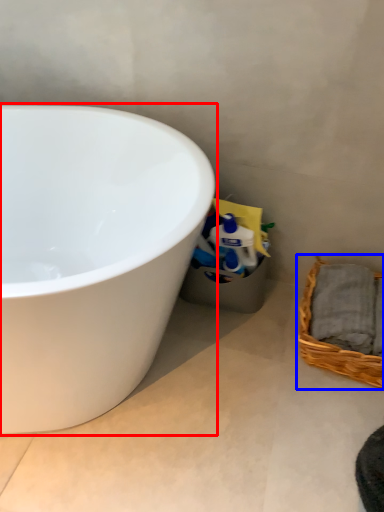
Question: Which point is further to the camera, bathtub (highlighted by a red box) or picnic basket (highlighted by a blue box)?

Choices:
 (A) bathtub
 (B) picnic basket

Answer: (B)